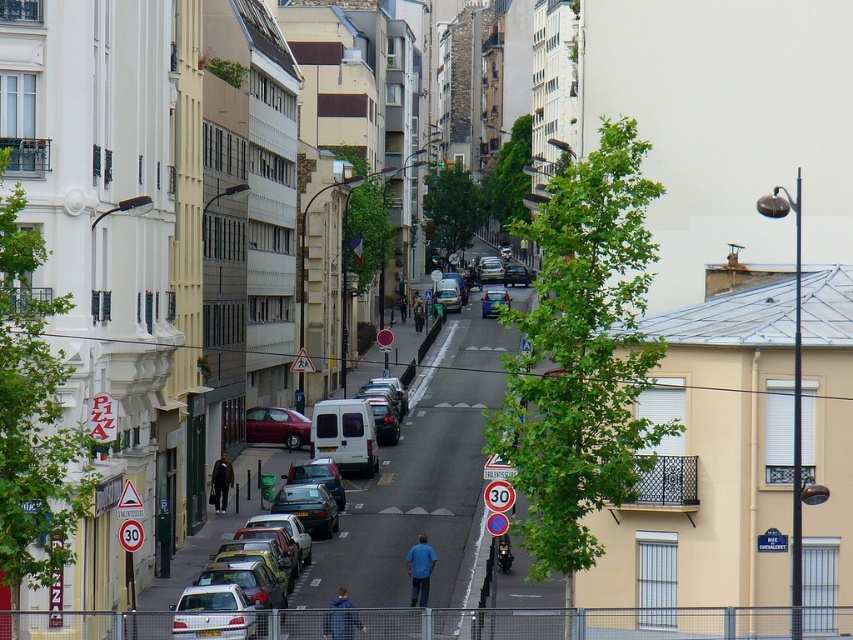
You are a delivery person standing at the blue fabric jacket at lower center location. You need to cross the street to deliver a package to a building on the other side. The silver metallic car at center is blocking your path. Can you safely walk around the car to reach the other side of the street?

The silver metallic car at center is 6.92 feet away from the blue fabric jacket at lower center. Since the distance between them is sufficient, you can safely walk around the car to reach the other side of the street.

You are a delivery person driving a van that is 7 meters long. You need to make a U turn on the street. The van requires a minimum of 15 meters to safely complete the U turn. Can you safely perform the U turn between the metallic blue car at center and the metallic silver car at center?

The distance between the metallic blue car at center and the metallic silver car at center is 17.65 meters. Since the van requires a minimum of 15 meters to safely complete the U turn, and the available space is 17.65 meters, which is more than sufficient, you can safely perform the U turn between the two cars.